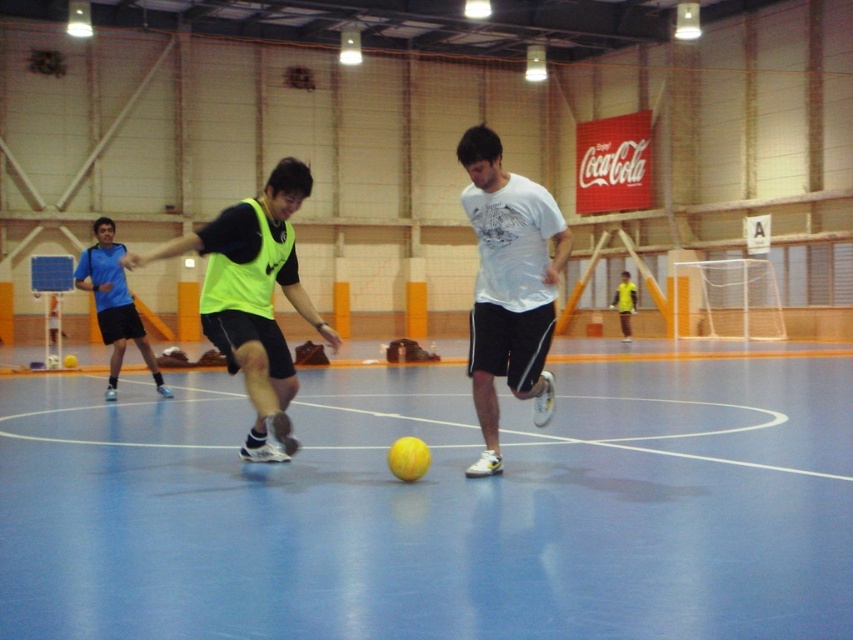
You are a sports analyst trying to track player movements in a futsal game. The playing area is represented on a coordinate grid where the bottom left corner is the origin point. The coordinates are given as fractions between 0 and 1. If the goal net is located at the bottom right corner of the grid, can you determine whether the neon yellow jersey at center is closer to the goal net or the opposite wall?

The neon yellow jersey at center is located at coordinates approximately 0.475 on the x axis and 0.134 on the y axis. Since the goal net is at the bottom right corner, its coordinates would be approximately (852, 639). To determine the distance, we can calculate the Euclidean distance from the jersey to the goal net and to the opposite wall. The distance to the goal net would be sqrt. However, since the y coordinate of the jersey is 0.134, which is closer to the bottom edge, and the x coordinate is 0.475, which is

You are a referee in the futsal game. You need to determine if the ball is within the playing area. The ball is at point (508, 285). Is the ball inside the field?

The ball is at the white matte t shirt at center, which is within the playing area. So yes, the ball is inside the field.